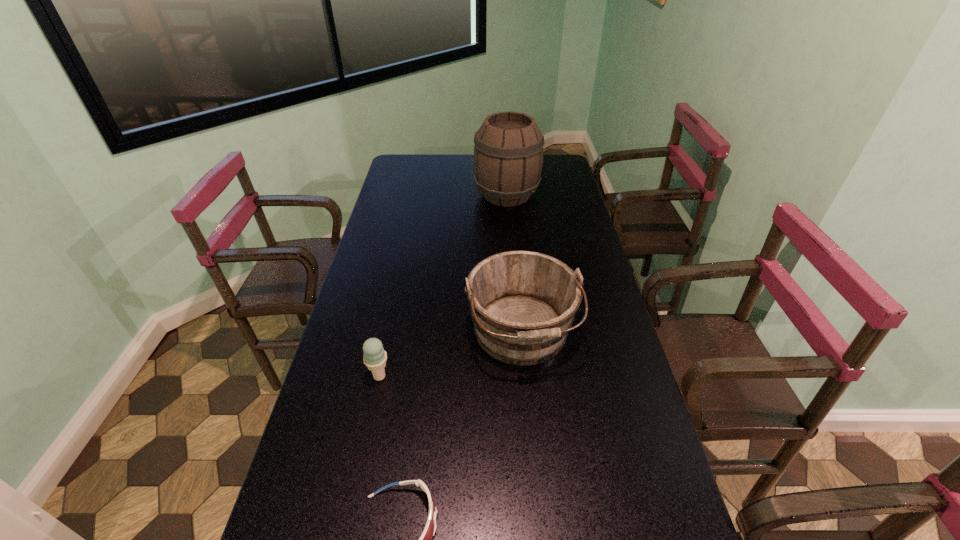
The image size is (960, 540). What are the coordinates of `vacant space at the left edge of the desktop` in the screenshot? It's located at (401, 276).

The height and width of the screenshot is (540, 960). In order to click on free space at the right edge of the desktop in this screenshot , I will do `click(564, 232)`.

Where is `free space at the far right corner of the desktop`? This screenshot has height=540, width=960. free space at the far right corner of the desktop is located at coordinates (557, 161).

At what (x,y) coordinates should I click in order to perform the action: click on free point between the farther wine bucket and the ice cream. Please return your answer as a coordinate pair (x, y). Looking at the image, I should click on (444, 285).

The image size is (960, 540). I want to click on empty space between the tallest object and the ice cream, so click(444, 285).

The height and width of the screenshot is (540, 960). What are the coordinates of `free space between the second shortest object and the farthest object` in the screenshot? It's located at (444, 285).

Locate which object is the closest to the shorter wine bucket. Please provide its 2D coordinates. Your answer should be formatted as a tuple, i.e. [(x, y)], where the tuple contains the x and y coordinates of a point satisfying the conditions above.

[(375, 356)]

Locate an element on the screen. This screenshot has height=540, width=960. the closest object to the farther wine bucket is located at coordinates (522, 303).

Image resolution: width=960 pixels, height=540 pixels. Identify the location of free space that satisfies the following two spatial constraints: 1. on the back side of the third shortest object; 2. on the left side of the third tallest object. (389, 333).